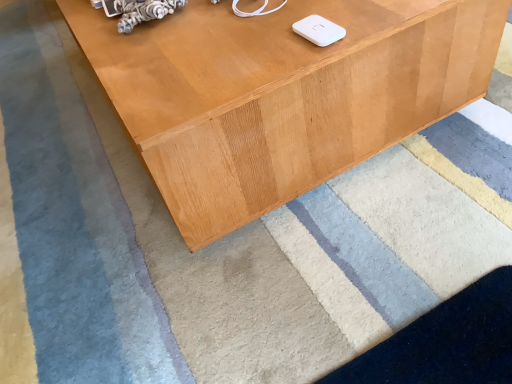
I want to click on free space to the right of white matte ipod at upper center, so click(x=368, y=15).